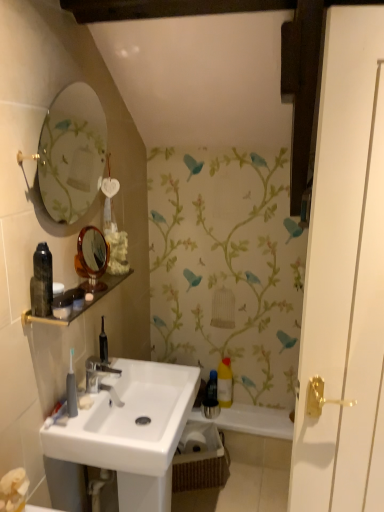
I want to click on unoccupied area in front of yellow plastic bottle at center, so click(243, 417).